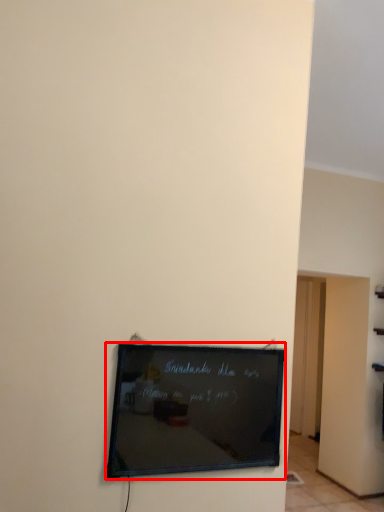
Question: From the image's perspective, what is the correct spatial relationship of picture frame (annotated by the red box) in relation to door?

Choices:
 (A) above
 (B) below

Answer: (A)